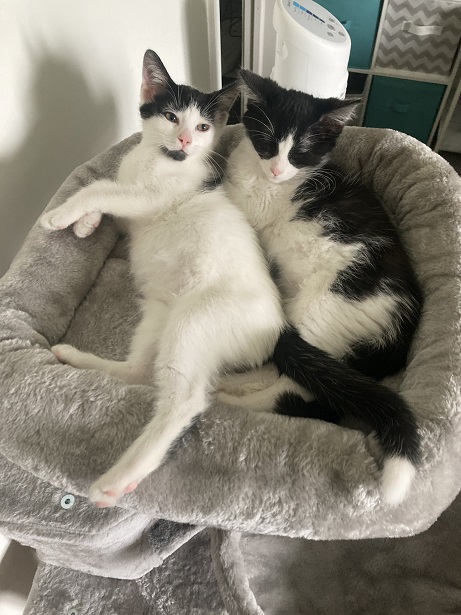
Locate an element on the screen. This screenshot has width=461, height=615. cat bed is located at coordinates (111, 315).